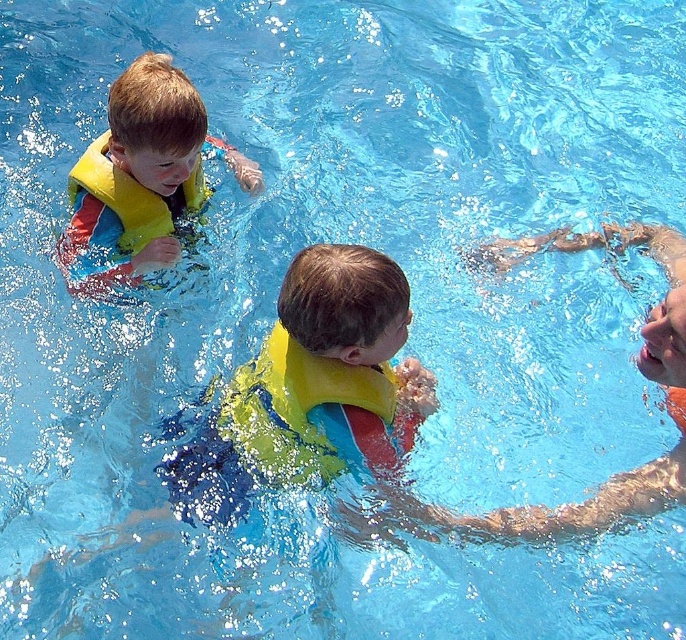
Question: Does yellow life vest at upper left appear over yellow life vest at center?

Choices:
 (A) yes
 (B) no

Answer: (A)

Question: Which point is closer to the camera?

Choices:
 (A) yellow life vest at center
 (B) yellow foam life jacket at center
 (C) yellow life vest at upper left

Answer: (A)

Question: Is yellow life vest at upper left below yellow life vest at center?

Choices:
 (A) yes
 (B) no

Answer: (B)

Question: Which point is farther to the camera?

Choices:
 (A) yellow foam life jacket at center
 (B) yellow life vest at center
 (C) yellow life vest at upper left

Answer: (C)

Question: Among these objects, which one is nearest to the camera?

Choices:
 (A) yellow life vest at upper left
 (B) yellow life vest at center
 (C) yellow foam life jacket at center

Answer: (B)

Question: Can you confirm if yellow life vest at upper left is positioned to the left of yellow foam life jacket at center?

Choices:
 (A) no
 (B) yes

Answer: (B)